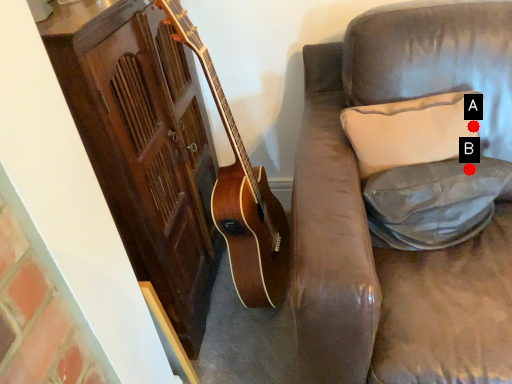
Question: Two points are circled on the image, labeled by A and B beside each circle. Which point is closer to the camera?

Choices:
 (A) A is closer
 (B) B is closer

Answer: (B)